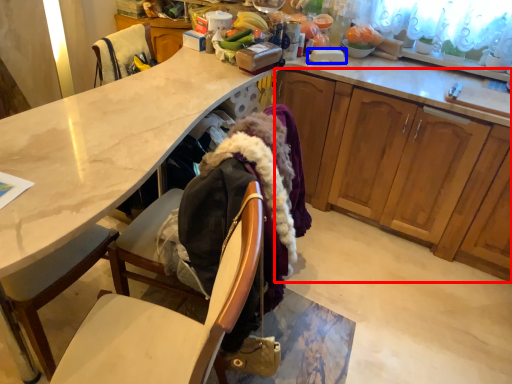
Question: Which point is further to the camera, cabinetry (highlighted by a red box) or plate (highlighted by a blue box)?

Choices:
 (A) cabinetry
 (B) plate

Answer: (B)